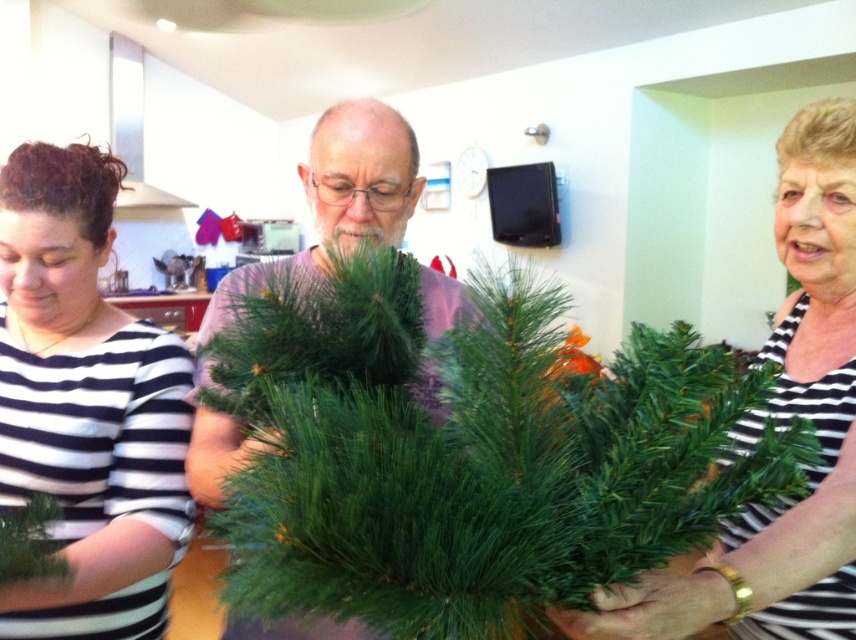
Does green artificial at center lie in front of black striped shirt at left?

Yes, it is in front of black striped shirt at left.

Locate an element on the screen. green artificial at center is located at coordinates (468, 452).

Is point (397, 436) positioned behind point (80, 634)?

No, (397, 436) is closer to viewer.

Image resolution: width=856 pixels, height=640 pixels. I want to click on green artificial at center, so click(x=468, y=452).

Does green artificial at center appear on the left side of green matte pine branch at right?

Correct, you'll find green artificial at center to the left of green matte pine branch at right.

Is green artificial at center below green matte pine branch at right?

Yes, green artificial at center is below green matte pine branch at right.

This screenshot has height=640, width=856. I want to click on green artificial at center, so click(468, 452).

Can you confirm if black striped shirt at left is positioned below green artificial tree at center?

Indeed, black striped shirt at left is positioned under green artificial tree at center.

What do you see at coordinates (85, 406) in the screenshot?
I see `black striped shirt at left` at bounding box center [85, 406].

What do you see at coordinates (85, 406) in the screenshot?
I see `black striped shirt at left` at bounding box center [85, 406].

This screenshot has width=856, height=640. Find the location of `black striped shirt at left`. black striped shirt at left is located at coordinates (85, 406).